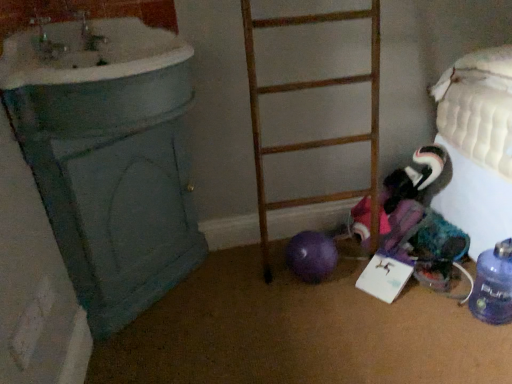
I want to click on free point below wooden ladder at center (from a real-world perspective), so click(x=328, y=234).